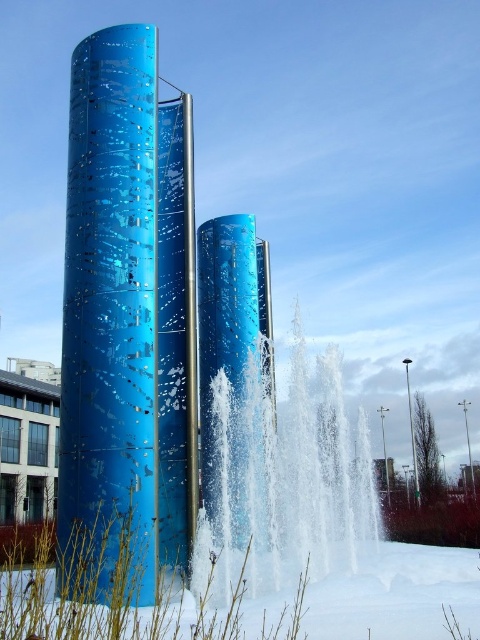
Question: Which point appears closest to the camera in this image?

Choices:
 (A) (226, 483)
 (B) (169, 529)
 (C) (259, 396)

Answer: (A)

Question: Can you confirm if clear water at center is positioned below glossy metallic tower at center?

Choices:
 (A) no
 (B) yes

Answer: (B)

Question: Is blue metallic tower at left to the left of clear water at center from the viewer's perspective?

Choices:
 (A) no
 (B) yes

Answer: (B)

Question: Which of the following is the closest to the observer?

Choices:
 (A) blue metallic tower at left
 (B) clear water at center
 (C) glossy metallic tower at center

Answer: (A)

Question: Considering the real-world distances, which object is farthest from the clear water at center?

Choices:
 (A) blue metallic tower at left
 (B) glossy metallic tower at center

Answer: (A)

Question: Where is clear water at center located in relation to glossy metallic tower at center in the image?

Choices:
 (A) left
 (B) right

Answer: (B)